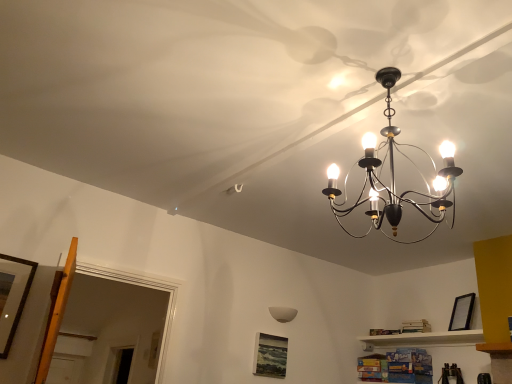
Question: From a real-world perspective, is wooden picture frame at left, marked as the 3th picture frame in a bottom-to-top arrangement, positioned above or below white matte lampshade at center?

Choices:
 (A) above
 (B) below

Answer: (B)

Question: Based on their sizes in the image, would you say wooden picture frame at left, which is the 1th picture frame from front to back, is bigger or smaller than white matte lampshade at center?

Choices:
 (A) small
 (B) big

Answer: (B)

Question: Based on their relative distances, which object is farther from the matte black picture frame at lower center, which is counted as the third picture frame, starting from the front?

Choices:
 (A) wooden picture frame at left, the 1th picture frame from the left
 (B) black matte picture frame at upper right, the 2th picture frame positioned from the front
 (C) white matte lampshade at center

Answer: (A)

Question: Considering the real-world distances, which object is closest to the black matte picture frame at upper right, positioned as the third picture frame in left-to-right order?

Choices:
 (A) matte black picture frame at lower center, positioned as the 2th picture frame in right-to-left order
 (B) white matte lampshade at center
 (C) wooden picture frame at left, which ranks as the first picture frame in top-to-bottom order

Answer: (B)